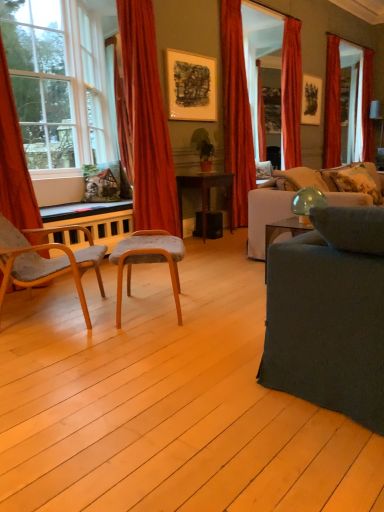
Question: Considering the relative sizes of dark gray fabric couch at right, the 1th studio couch when ordered from front to back, and green matte houseplant at center in the image provided, is dark gray fabric couch at right, the 1th studio couch when ordered from front to back, bigger than green matte houseplant at center?

Choices:
 (A) no
 (B) yes

Answer: (B)

Question: From a real-world perspective, is dark gray fabric couch at right, which ranks as the second studio couch in back-to-front order, positioned under green matte houseplant at center based on gravity?

Choices:
 (A) no
 (B) yes

Answer: (B)

Question: Does dark gray fabric couch at right, which ranks as the second studio couch in back-to-front order, have a greater width compared to green matte houseplant at center?

Choices:
 (A) yes
 (B) no

Answer: (A)

Question: Considering the relative sizes of dark gray fabric couch at right, which ranks as the second studio couch in back-to-front order, and green matte houseplant at center in the image provided, is dark gray fabric couch at right, which ranks as the second studio couch in back-to-front order, thinner than green matte houseplant at center?

Choices:
 (A) no
 (B) yes

Answer: (A)

Question: From the image's perspective, is dark gray fabric couch at right, which ranks as the second studio couch in back-to-front order, over green matte houseplant at center?

Choices:
 (A) yes
 (B) no

Answer: (B)

Question: Would you say velvet orange curtain at upper right, which appears as the 4th curtain when viewed from the front, is to the left or to the right of green matte houseplant at center in the picture?

Choices:
 (A) right
 (B) left

Answer: (A)

Question: Relative to green matte houseplant at center, is velvet orange curtain at upper right, arranged as the 2th curtain when viewed from the right, in front or behind?

Choices:
 (A) behind
 (B) front

Answer: (A)

Question: Is velvet orange curtain at upper right, which appears as the 4th curtain when viewed from the front, situated inside green matte houseplant at center or outside?

Choices:
 (A) inside
 (B) outside

Answer: (B)

Question: Is point (284, 83) positioned closer to the camera than point (208, 162)?

Choices:
 (A) closer
 (B) farther

Answer: (B)

Question: Considering the relative positions of matte black picture frame at upper right, the 2th picture frame viewed from the front, and matte black picture frame at upper center, marked as the 1th picture frame in a bottom-to-top arrangement, in the image provided, is matte black picture frame at upper right, the 2th picture frame viewed from the front, to the left or to the right of matte black picture frame at upper center, marked as the 1th picture frame in a bottom-to-top arrangement,?

Choices:
 (A) left
 (B) right

Answer: (B)

Question: Is matte black picture frame at upper right, the 2th picture frame viewed from the front, bigger or smaller than matte black picture frame at upper center, the 2th picture frame from the top?

Choices:
 (A) small
 (B) big

Answer: (A)

Question: Looking at their shapes, would you say matte black picture frame at upper right, the second picture frame positioned from the bottom, is wider or thinner than matte black picture frame at upper center, the 2th picture frame viewed from the back?

Choices:
 (A) thin
 (B) wide

Answer: (A)

Question: From their relative heights in the image, would you say matte black picture frame at upper right, the 2th picture frame viewed from the front, is taller or shorter than matte black picture frame at upper center, marked as the 1th picture frame in a bottom-to-top arrangement?

Choices:
 (A) tall
 (B) short

Answer: (A)

Question: Is dark gray fabric couch at right, the 1th studio couch when ordered from front to back, in front of or behind gray fabric stool at center, the 2th chair positioned from the left, in the image?

Choices:
 (A) front
 (B) behind

Answer: (A)

Question: Based on their sizes in the image, would you say dark gray fabric couch at right, which ranks as the second studio couch in back-to-front order, is bigger or smaller than gray fabric stool at center, which appears as the 1th chair when viewed from the right?

Choices:
 (A) big
 (B) small

Answer: (A)